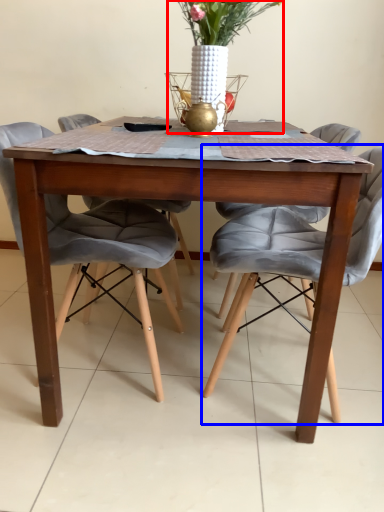
Question: Which object is further to the camera taking this photo, floral arrangement (highlighted by a red box) or chair (highlighted by a blue box)?

Choices:
 (A) floral arrangement
 (B) chair

Answer: (A)